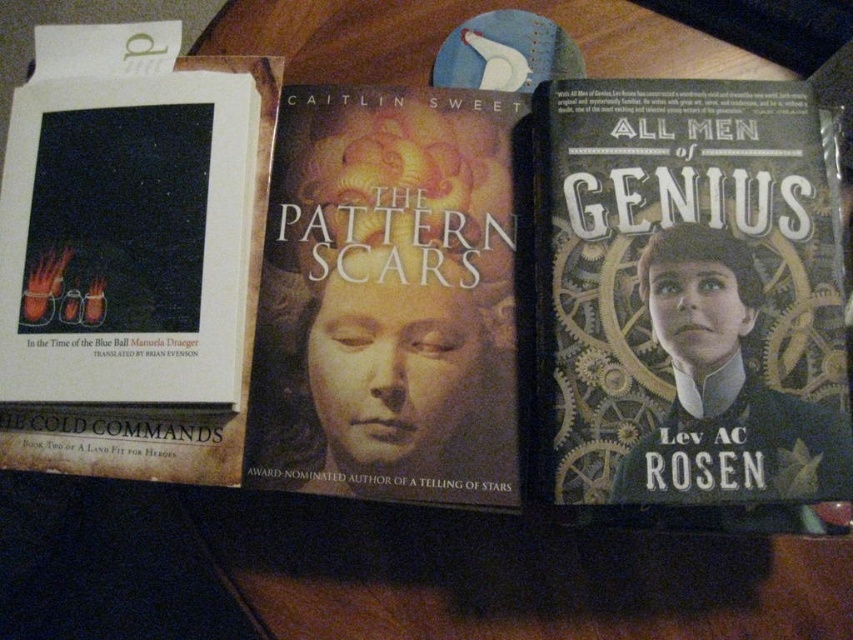
Question: Which of the following is the farthest from the observer?

Choices:
 (A) pos(556,388)
 (B) pos(431,362)

Answer: (B)

Question: Is steampunk-patterned book cover at right closer to the viewer compared to matte paper book cover at center?

Choices:
 (A) no
 (B) yes

Answer: (B)

Question: Among these objects, which one is farthest from the camera?

Choices:
 (A) steampunk-patterned book cover at right
 (B) matte paper book cover at center

Answer: (B)

Question: Is the position of steampunk-patterned book cover at right less distant than that of matte paper book cover at center?

Choices:
 (A) no
 (B) yes

Answer: (B)

Question: In this image, where is steampunk-patterned book cover at right located relative to matte paper book cover at center?

Choices:
 (A) left
 (B) right

Answer: (B)